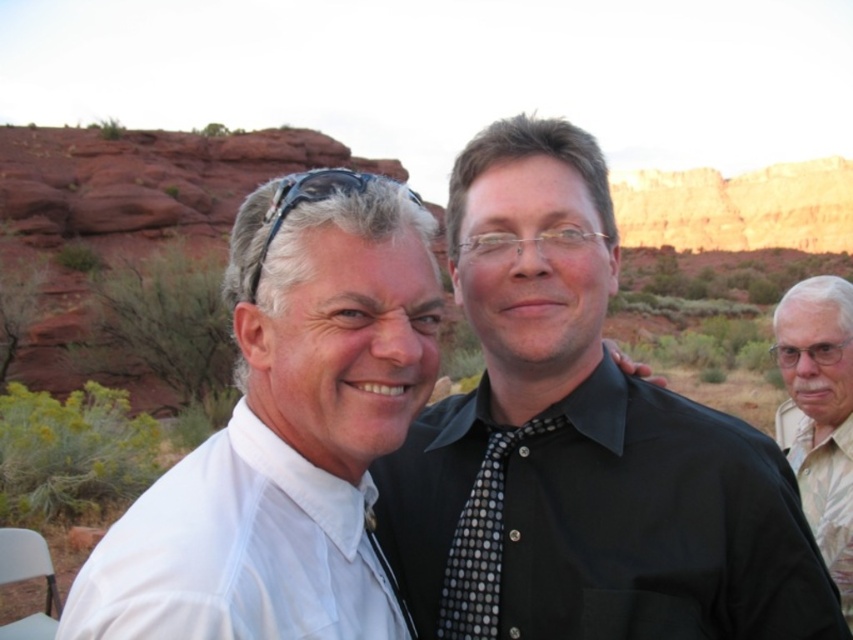
You are a photographer trying to capture a portrait of the two individuals in the scene. The camera you are using has a focal length of 50mm. Given that the white smooth shirt at left is positioned at coordinates point 0.864, 0.279, can you determine if the shirt will be within the frame of your photo?

The white smooth shirt at left is located at point (236, 552), which falls within the camera frame when using a 50mm focal length. Therefore, the shirt will be within the frame of the photo.

You are a photographer trying to capture a portrait of the two people in the scene. You want to ensure the black dotted tie at center and the white smooth shirt at left are both clearly visible. Which object should you focus on first to ensure both are in focus?

The black dotted tie at center is above the white smooth shirt at left, so focusing on the white smooth shirt at left first will ensure both are in focus since it is closer to the camera.